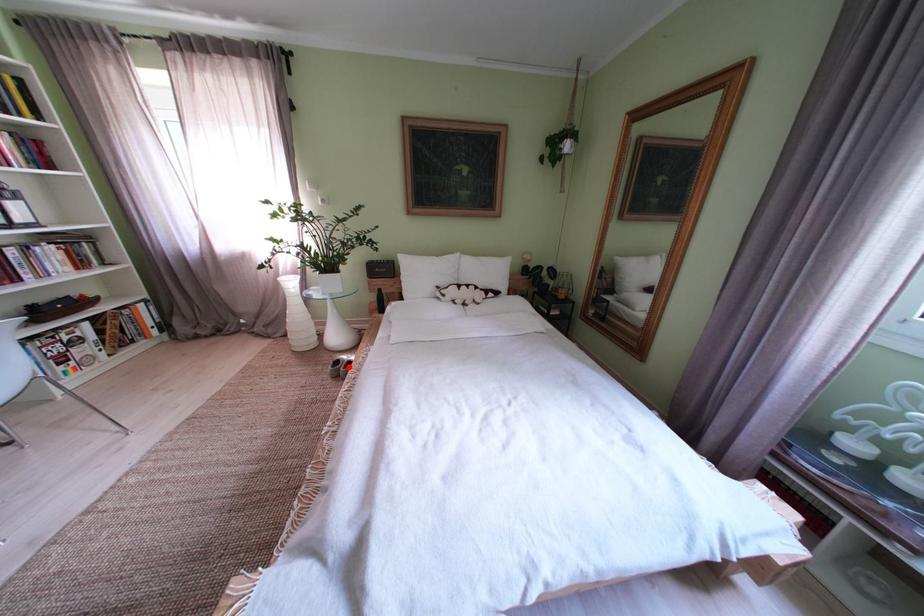
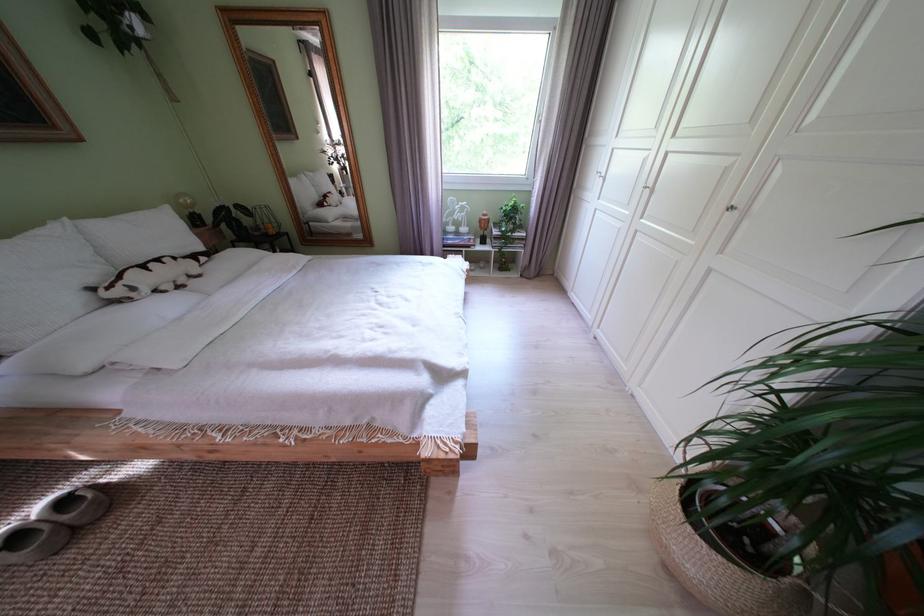
Question: I am providing you with two images of the same scene from different viewpoints. Given a red point in image1, look at the same physical point in image2. Is it:

Choices:
 (A) Closer to the viewpoint
 (B) Farther from the viewpoint

Answer: (A)